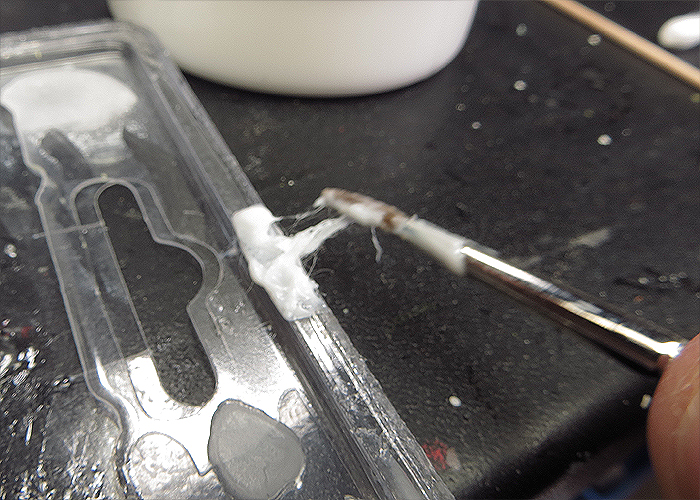
I want to click on white spots on table, so click(517, 86), click(519, 29), click(607, 141), click(596, 37).